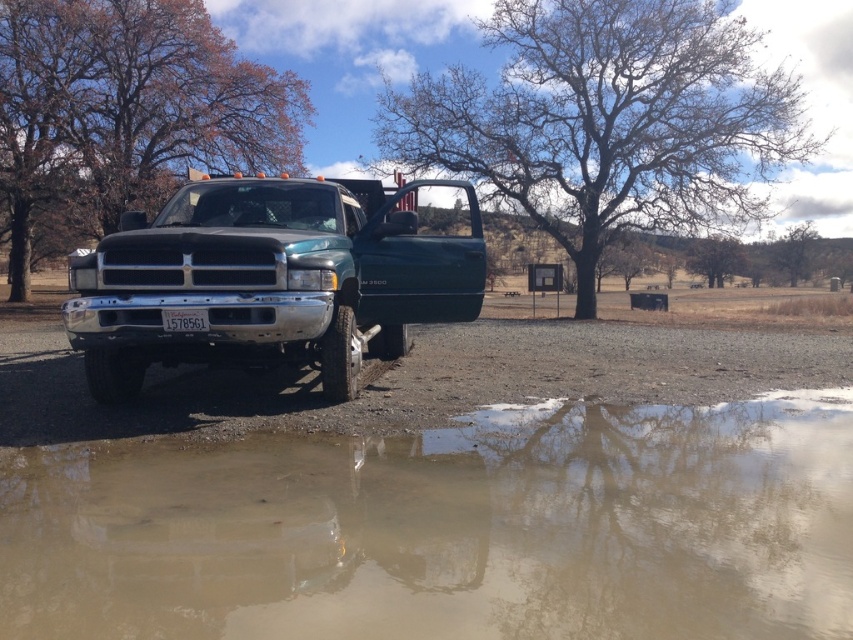
Between bare branches at upper center and green leafy tree at center, which one appears on the left side from the viewer's perspective?

bare branches at upper center is more to the left.

Between bare branches at upper center and green leafy tree at center, which one has less height?

green leafy tree at center

You are a GUI agent. You are given a task and a screenshot of the screen. Output one action in this format:
    pyautogui.click(x=<x>, y=<y>)
    Task: Click on the bare branches at upper center
    
    Given the screenshot: What is the action you would take?
    pyautogui.click(x=608, y=120)

Can you confirm if brown muddy water at lower center is wider than bare branches tree at upper center?

No.

What do you see at coordinates (453, 531) in the screenshot? This screenshot has width=853, height=640. I see `brown muddy water at lower center` at bounding box center [453, 531].

The height and width of the screenshot is (640, 853). Identify the location of brown muddy water at lower center. (453, 531).

This screenshot has width=853, height=640. I want to click on brown muddy water at lower center, so click(x=453, y=531).

Is bare branches at upper center above shiny black truck at center?

Yes.

Is point (785, 131) farther from camera compared to point (276, 211)?

Yes.

Image resolution: width=853 pixels, height=640 pixels. What do you see at coordinates (608, 120) in the screenshot?
I see `bare branches at upper center` at bounding box center [608, 120].

This screenshot has height=640, width=853. What are the coordinates of `bare branches at upper center` in the screenshot? It's located at (608, 120).